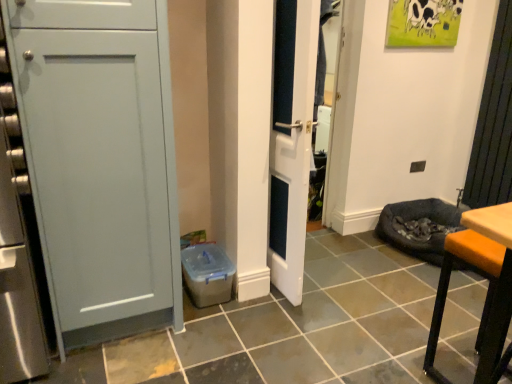
Question: Looking at their shapes, would you say orange leather stool at lower right is wider or thinner than white glossy door at center?

Choices:
 (A) thin
 (B) wide

Answer: (B)

Question: Is orange leather stool at lower right bigger or smaller than white glossy door at center?

Choices:
 (A) big
 (B) small

Answer: (B)

Question: Is point (504, 258) closer or farther from the camera than point (281, 183)?

Choices:
 (A) farther
 (B) closer

Answer: (B)

Question: Visually, is white glossy door at center positioned to the left or to the right of orange leather stool at lower right?

Choices:
 (A) right
 (B) left

Answer: (B)

Question: Considering the positions of white glossy door at center and orange leather stool at lower right in the image, is white glossy door at center taller or shorter than orange leather stool at lower right?

Choices:
 (A) short
 (B) tall

Answer: (B)

Question: In the image, is white glossy door at center positioned in front of or behind orange leather stool at lower right?

Choices:
 (A) front
 (B) behind

Answer: (B)

Question: From the image's perspective, is white glossy door at center above or below orange leather stool at lower right?

Choices:
 (A) above
 (B) below

Answer: (A)